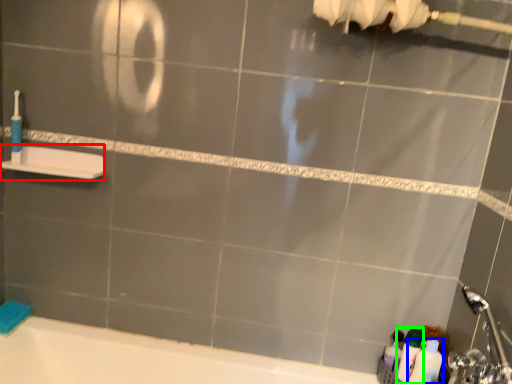
Question: Estimate the real-world distances between objects in this image. Which object is farther from towel bar (highlighted by a red box), toiletry (highlighted by a blue box) or cleaning product (highlighted by a green box)?

Choices:
 (A) toiletry
 (B) cleaning product

Answer: (A)